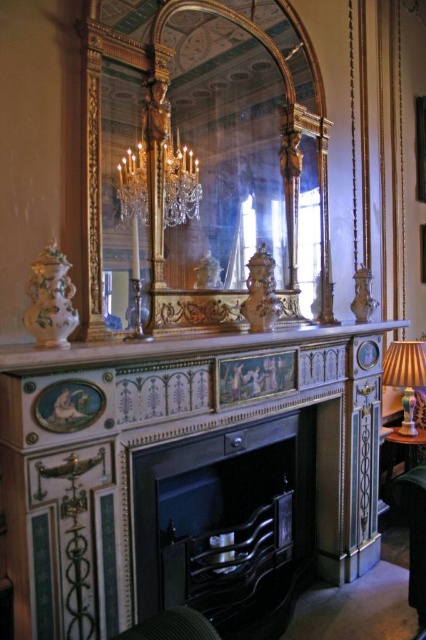
Question: Among these points, which one is nearest to the camera?

Choices:
 (A) (299, 332)
 (B) (285, 477)
 (C) (405, 387)

Answer: (A)

Question: Considering the relative positions of gold/gilded mirror at center and white marble mantelpiece at center in the image provided, where is gold/gilded mirror at center located with respect to white marble mantelpiece at center?

Choices:
 (A) right
 (B) left

Answer: (A)

Question: From the image, what is the correct spatial relationship of white marble mantelpiece at center in relation to matte gold lampshade at right?

Choices:
 (A) right
 (B) left

Answer: (B)

Question: Which of the following is the farthest from the observer?

Choices:
 (A) (423, 440)
 (B) (408, 346)
 (C) (195, 48)
 (D) (157, 456)

Answer: (B)

Question: Is gold/gilded mirror at center bigger than white marble mantelpiece at center?

Choices:
 (A) no
 (B) yes

Answer: (B)

Question: Among these points, which one is farthest from the camera?

Choices:
 (A) (244, 593)
 (B) (417, 352)

Answer: (B)